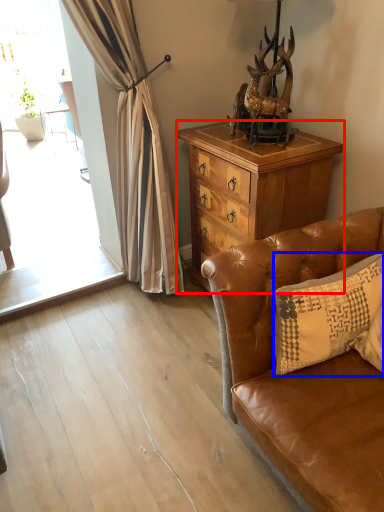
Question: Which object is further to the camera taking this photo, cabinetry (highlighted by a red box) or pillow (highlighted by a blue box)?

Choices:
 (A) cabinetry
 (B) pillow

Answer: (A)